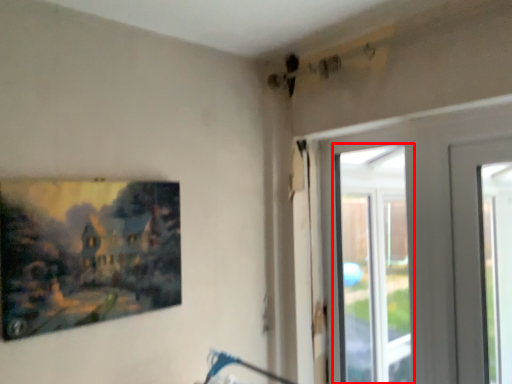
Question: Observing the image, what is the correct spatial positioning of window (annotated by the red box) in reference to picture frame?

Choices:
 (A) left
 (B) right

Answer: (B)